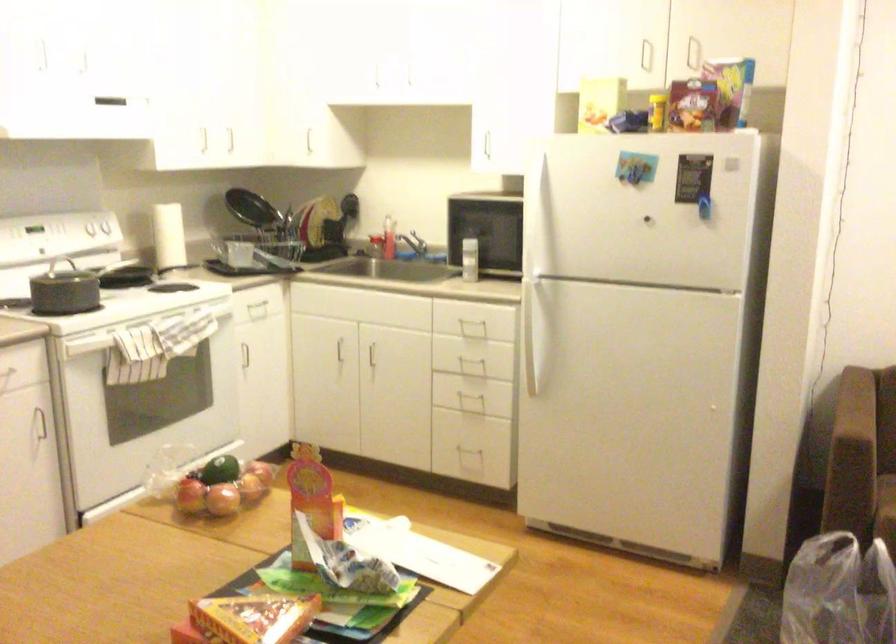
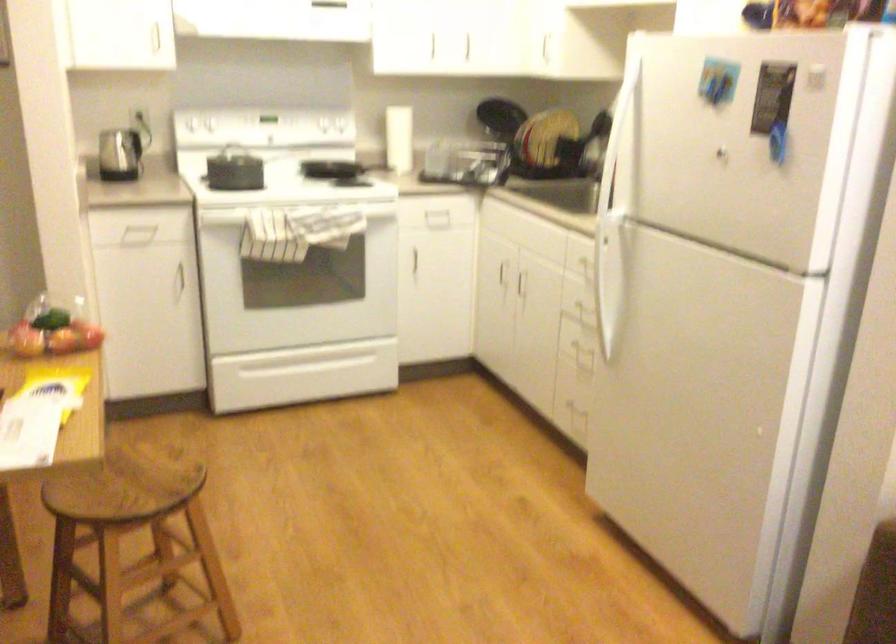
Find the pixel in the second image that matches pixel 276 372 in the first image.

(435, 276)